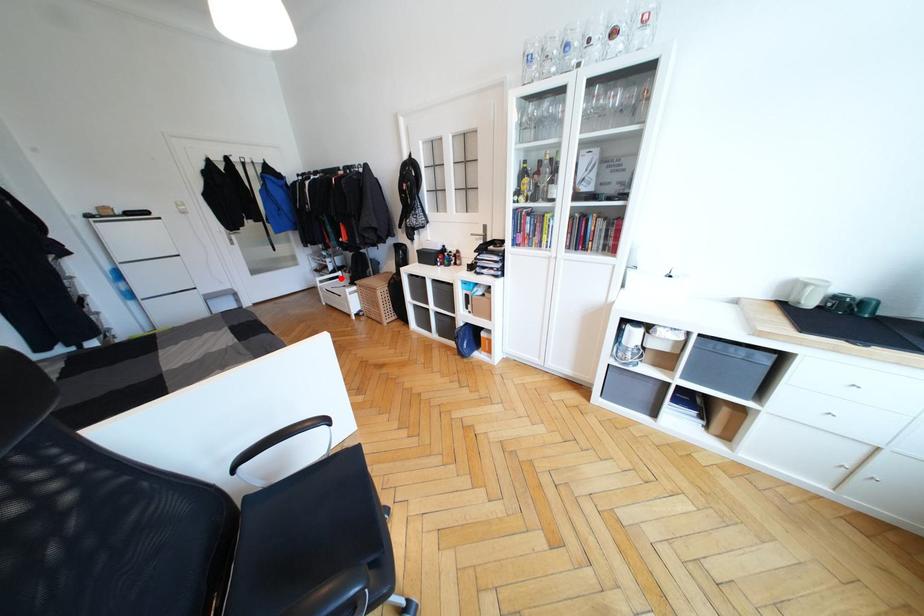
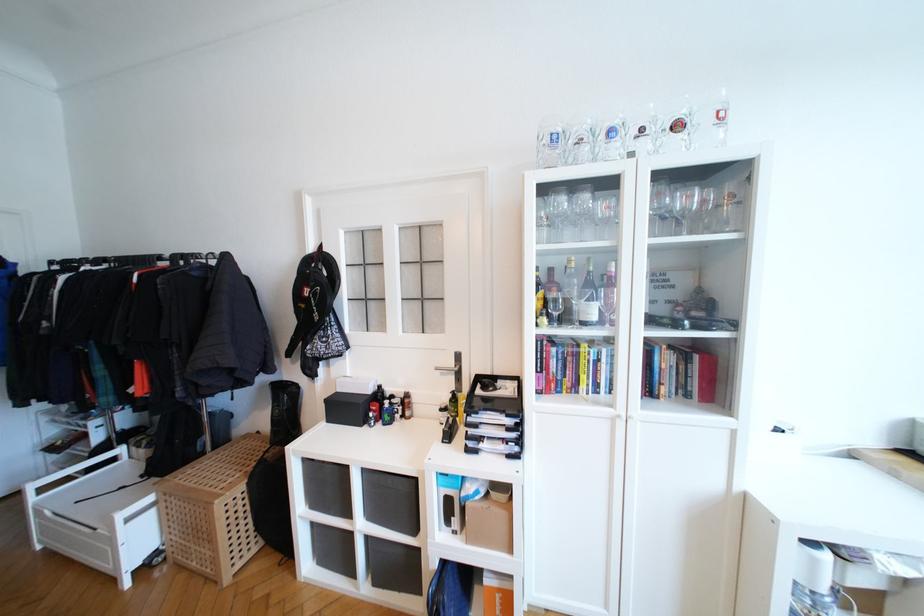
Find the pixel in the second image that matches the highlighted location in the first image.

(116, 461)